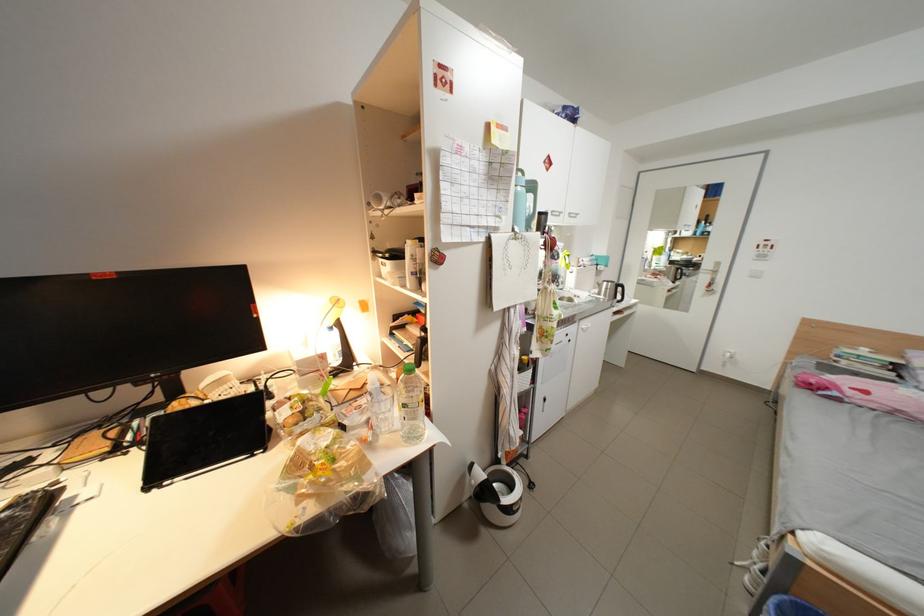
The height and width of the screenshot is (616, 924). What do you see at coordinates (481, 485) in the screenshot? I see `a kettle handle` at bounding box center [481, 485].